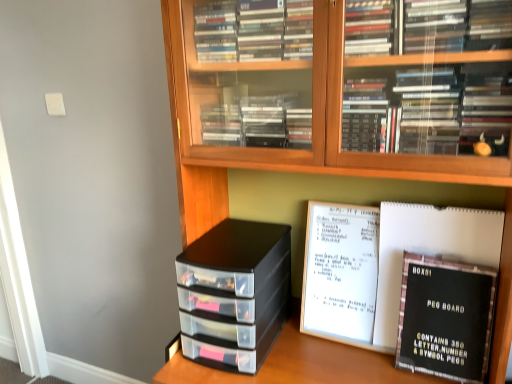
At what (x,y) coordinates should I click in order to perform the action: click on vacant region above black matte peg board at center right (from a real-world perspective). Please return your answer as a coordinate pair (x, y). The height and width of the screenshot is (384, 512). Looking at the image, I should click on (437, 207).